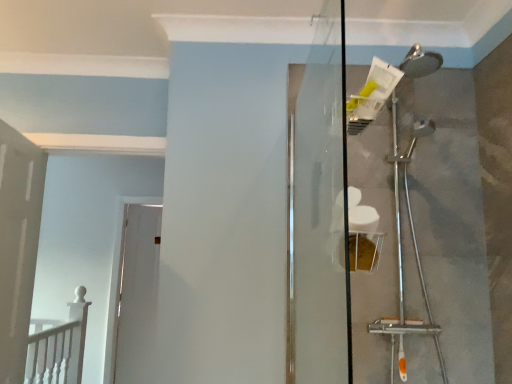
Question: Visually, is white wooden railing at lower left positioned to the left or to the right of white painted wood door at left, which is the first door in front-to-back order?

Choices:
 (A) left
 (B) right

Answer: (A)

Question: Is white wooden railing at lower left bigger or smaller than white painted wood door at left, which is the first door in front-to-back order?

Choices:
 (A) small
 (B) big

Answer: (B)

Question: Based on their relative distances, which object is nearer to the white wooden railing at lower left?

Choices:
 (A) transparent glass screen door at center
 (B) white painted wood door at left, which is counted as the 2th door, starting from the back
 (C) white glossy door at center, the 1th door viewed from the back

Answer: (B)

Question: Estimate the real-world distances between objects in this image. Which object is closer to the transparent glass screen door at center?

Choices:
 (A) white glossy door at center, the 1th door viewed from the back
 (B) white wooden railing at lower left
 (C) white painted wood door at left, which is the first door in front-to-back order

Answer: (C)